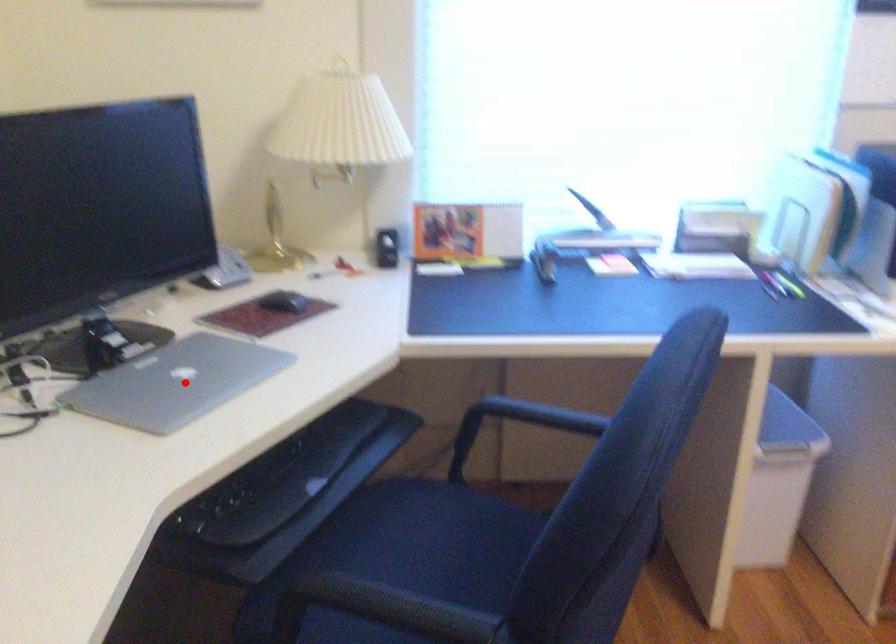
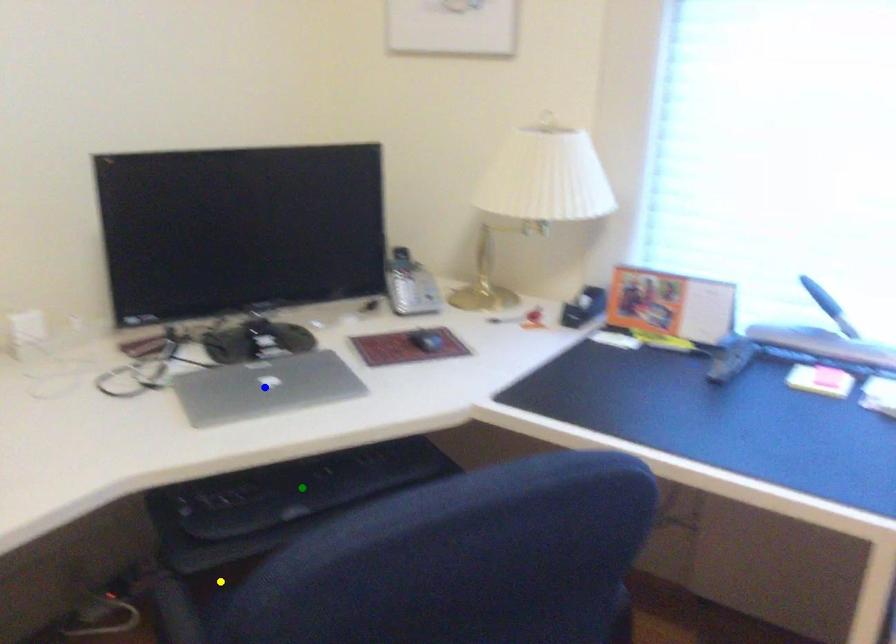
Question: I am providing you with two images of the same scene from different viewpoints. A red point is marked on the first image. You are given multiple points on the second image. Which point in image 2 represents the same 3d spot as the red point in image 1?

Choices:
 (A) blue point
 (B) green point
 (C) yellow point

Answer: (A)